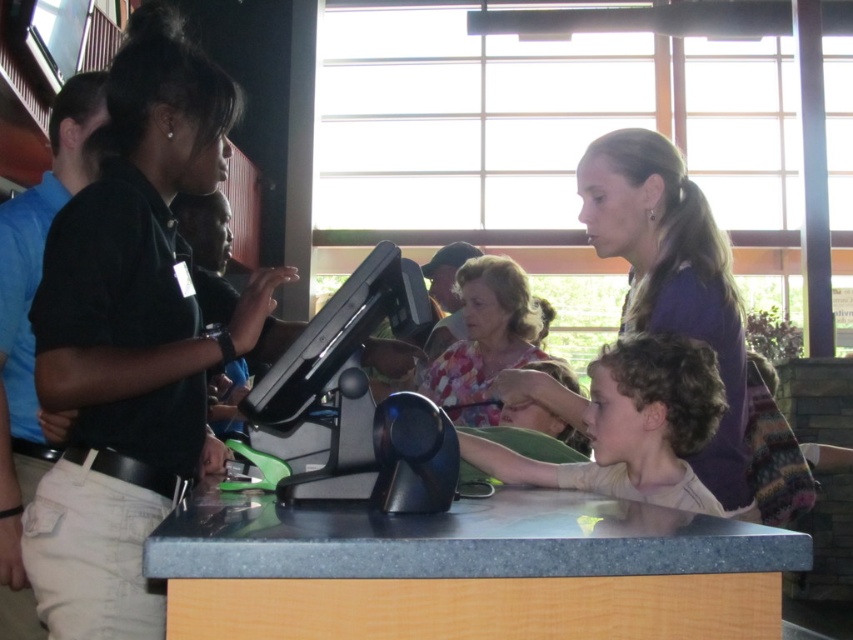
Question: Does purple matte shirt at upper right have a lesser width compared to floral fabric blouse at center?

Choices:
 (A) yes
 (B) no

Answer: (A)

Question: Can you confirm if purple matte shirt at upper right is thinner than floral fabric blouse at center?

Choices:
 (A) yes
 (B) no

Answer: (A)

Question: Which object appears farthest from the camera in this image?

Choices:
 (A) floral fabric blouse at center
 (B) purple matte shirt at upper right
 (C) curly brown hair at center

Answer: (A)

Question: Which point appears closest to the camera in this image?

Choices:
 (A) (515, 320)
 (B) (544, 516)
 (C) (631, 164)
 (D) (473, 451)

Answer: (B)

Question: Does purple matte shirt at upper right lie in front of curly brown hair at center?

Choices:
 (A) no
 (B) yes

Answer: (A)

Question: Among these objects, which one is farthest from the camera?

Choices:
 (A) floral fabric blouse at center
 (B) curly brown hair at center
 (C) purple matte shirt at upper right

Answer: (A)